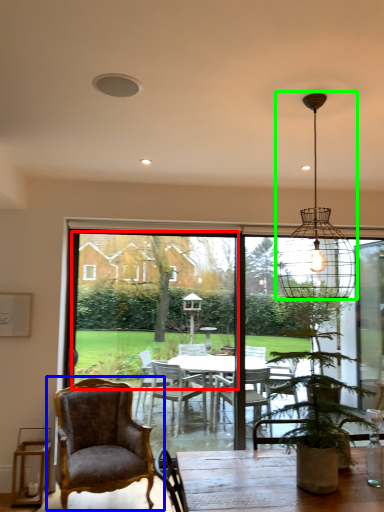
Question: Which object is the closest to the window screen (highlighted by a red box)? Choose among these: chair (highlighted by a blue box) or light fixture (highlighted by a green box).

Choices:
 (A) chair
 (B) light fixture

Answer: (A)